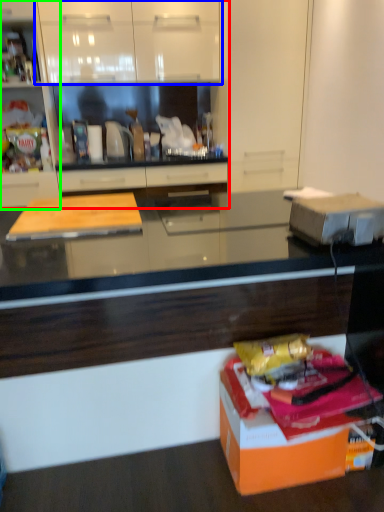
Question: Considering the real-world distances, which object is farthest from cabinetry (highlighted by a red box)? cabinetry (highlighted by a blue box) or cabinetry (highlighted by a green box)?

Choices:
 (A) cabinetry
 (B) cabinetry

Answer: (B)